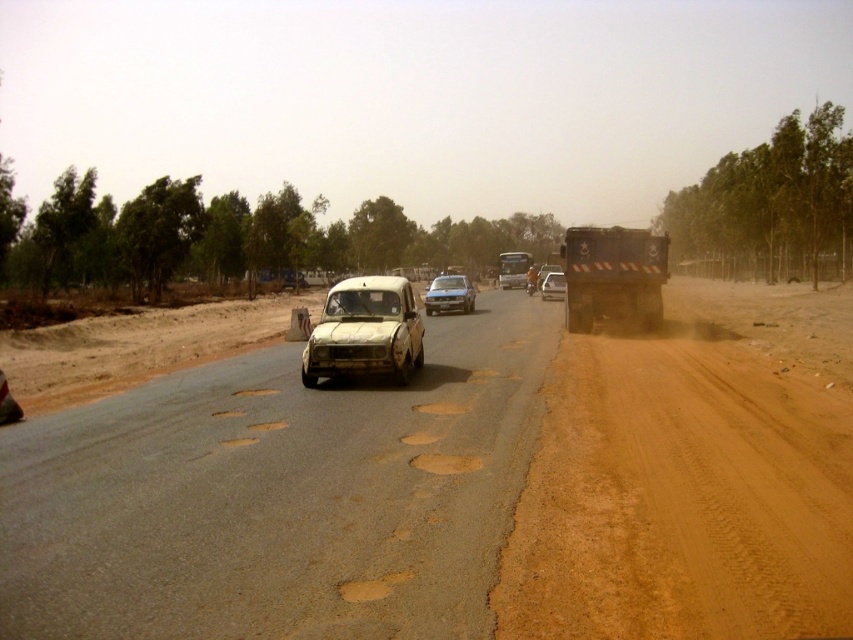
Question: Can you confirm if metallic gray truck at right is thinner than metallic silver bus at center?

Choices:
 (A) yes
 (B) no

Answer: (A)

Question: Which point appears closest to the camera in this image?

Choices:
 (A) (564, 291)
 (B) (498, 273)

Answer: (A)

Question: Based on their relative distances, which object is farther from the metallic gray truck at right?

Choices:
 (A) white matte car at center
 (B) metallic silver truck at right
 (C) dirty beige car at center

Answer: (B)

Question: Which point is closer to the camera?

Choices:
 (A) (585, 310)
 (B) (548, 285)
 (C) (512, 266)
 (D) (444, 275)

Answer: (A)

Question: Does dirty beige car at center appear over metallic silver truck at right?

Choices:
 (A) yes
 (B) no

Answer: (B)

Question: Is dirty beige car at center in front of white matte car at center?

Choices:
 (A) no
 (B) yes

Answer: (B)